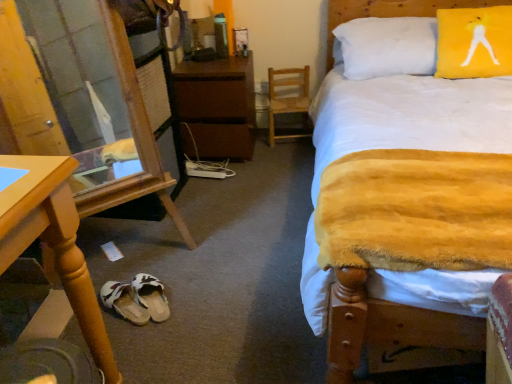
I want to click on vacant area in front of white fabric slipper at lower center, the 2th footwear in the left-to-right sequence, so click(154, 340).